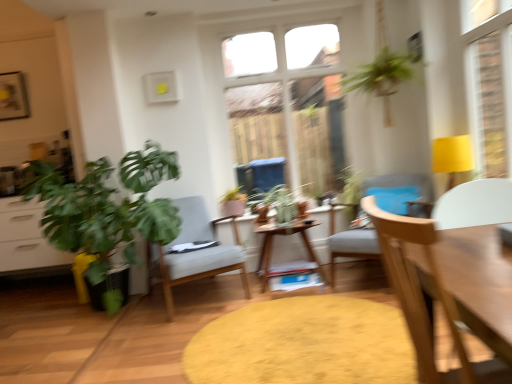
Question: Is light gray fabric chair at center, which is counted as the 3th chair, starting from the left, completely or partially outside of green leafy plant at left, which ranks as the 1th houseplant in front-to-back order?

Choices:
 (A) yes
 (B) no

Answer: (A)

Question: Considering the relative positions of light gray fabric chair at center, acting as the 1th chair starting from the right, and green leafy plant at left, which ranks as the 1th houseplant in front-to-back order, in the image provided, is light gray fabric chair at center, acting as the 1th chair starting from the right, behind green leafy plant at left, which ranks as the 1th houseplant in front-to-back order,?

Choices:
 (A) no
 (B) yes

Answer: (B)

Question: Are light gray fabric chair at center, acting as the 1th chair starting from the right, and green leafy plant at left, which ranks as the 1th houseplant in front-to-back order, making contact?

Choices:
 (A) no
 (B) yes

Answer: (A)

Question: From a real-world perspective, is light gray fabric chair at center, marked as the 2th chair in a front-to-back arrangement, below green leafy plant at left, the 1th houseplant when ordered from left to right?

Choices:
 (A) yes
 (B) no

Answer: (A)

Question: Is green leafy plant at left, which ranks as the 1th houseplant in front-to-back order, inside light gray fabric chair at center, acting as the 1th chair starting from the right?

Choices:
 (A) no
 (B) yes

Answer: (A)

Question: Looking at the image, does matte pink pot at center, which is the 2th houseplant from front to back, seem bigger or smaller compared to light gray fabric chair at center, the 1th chair positioned from the left?

Choices:
 (A) big
 (B) small

Answer: (B)

Question: From a real-world perspective, is matte pink pot at center, the second houseplant positioned from the left, positioned above or below light gray fabric chair at center, the 1th chair positioned from the left?

Choices:
 (A) above
 (B) below

Answer: (A)

Question: Is point (224, 213) positioned closer to the camera than point (202, 213)?

Choices:
 (A) farther
 (B) closer

Answer: (A)

Question: In terms of height, does matte pink pot at center, the second houseplant positioned from the left, look taller or shorter compared to light gray fabric chair at center, which appears as the 3th chair when viewed from the front?

Choices:
 (A) short
 (B) tall

Answer: (A)

Question: Visually, is white glass window at center positioned to the left or to the right of white matte chair at right, placed as the 2th chair when sorted from left to right?

Choices:
 (A) right
 (B) left

Answer: (B)

Question: Looking at their shapes, would you say white glass window at center is wider or thinner than white matte chair at right, the third chair positioned from the back?

Choices:
 (A) thin
 (B) wide

Answer: (A)

Question: From the image's perspective, is white glass window at center positioned above or below white matte chair at right, arranged as the second chair when viewed from the right?

Choices:
 (A) below
 (B) above

Answer: (B)

Question: From their relative heights in the image, would you say white glass window at center is taller or shorter than white matte chair at right, the 1th chair when ordered from front to back?

Choices:
 (A) short
 (B) tall

Answer: (B)

Question: Looking at the image, does white matte chair at right, placed as the 2th chair when sorted from left to right, seem bigger or smaller compared to light gray fabric chair at center, which appears as the third chair when viewed from the right?

Choices:
 (A) small
 (B) big

Answer: (A)

Question: Considering the positions of point (395, 240) and point (155, 253), is point (395, 240) closer or farther from the camera than point (155, 253)?

Choices:
 (A) farther
 (B) closer

Answer: (B)